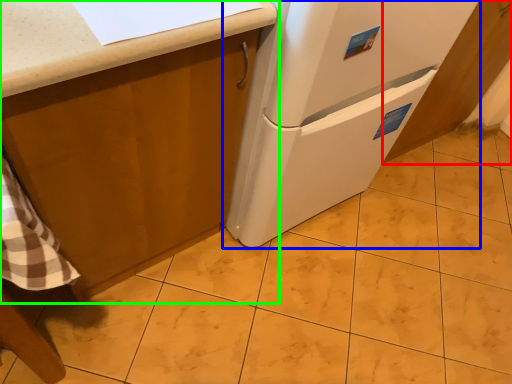
Question: Which object is positioned closest to cabinetry (highlighted by a red box)? Select from refrigerator (highlighted by a blue box) and cabinetry (highlighted by a green box).

Choices:
 (A) refrigerator
 (B) cabinetry

Answer: (A)